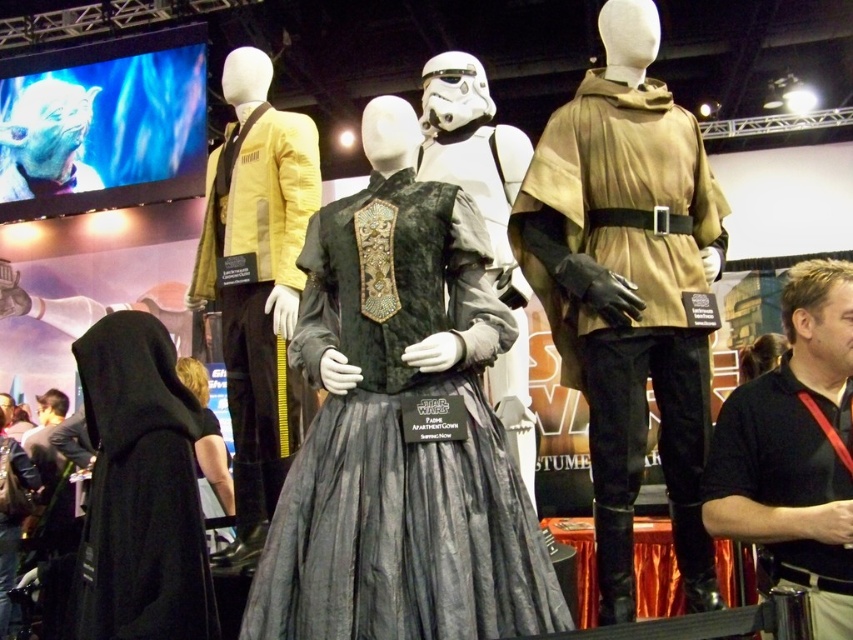
Which of these two, black matte robe at lower left or velvet black dress at center, stands shorter?

Standing shorter between the two is black matte robe at lower left.

Does black matte robe at lower left have a greater width compared to velvet black dress at center?

Correct, the width of black matte robe at lower left exceeds that of velvet black dress at center.

Does point (171, 387) come behind point (527, 460)?

No, it is in front of (527, 460).

The width and height of the screenshot is (853, 640). I want to click on black matte robe at lower left, so click(138, 490).

Is point (646, 90) closer to viewer compared to point (782, 310)?

No.

Who is more distant from viewer, (585, 172) or (795, 472)?

Point (585, 172)

Is point (676, 323) positioned behind point (706, 468)?

That is True.

You are a GUI agent. You are given a task and a screenshot of the screen. Output one action in this format:
    pyautogui.click(x=<x>, y=<y>)
    Task: Click on the matte brown cape at center
    
    Given the screenshot: What is the action you would take?
    pyautogui.click(x=628, y=291)

Is point (347, 465) less distant than point (227, 504)?

Yes, it is.

Can you confirm if dark gray satin dress at center is positioned to the left of black velvet dress at lower left?

No, dark gray satin dress at center is not to the left of black velvet dress at lower left.

Locate an element on the screen. The width and height of the screenshot is (853, 640). dark gray satin dress at center is located at coordinates (401, 436).